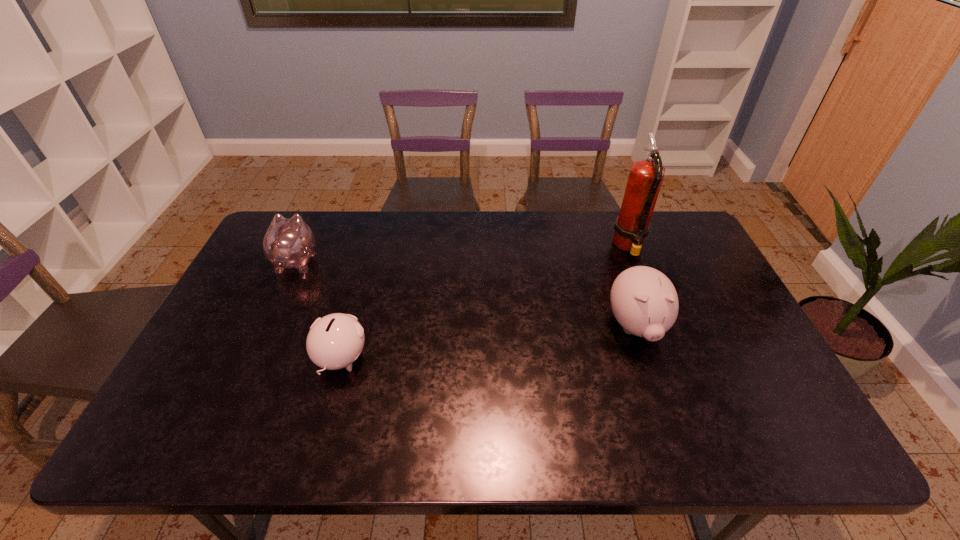
Identify the location of vacant point located on the front facing side of the leftmost piggy bank. The height and width of the screenshot is (540, 960). (311, 230).

Identify the location of blank space located 0.120m on the front facing side of the leftmost piggy bank. Image resolution: width=960 pixels, height=540 pixels. (314, 222).

The image size is (960, 540). Identify the location of vacant point located 0.110m on the front facing side of the leftmost piggy bank. (313, 224).

The image size is (960, 540). I want to click on free point located 0.050m on the right of the shortest piggy bank, so click(x=388, y=360).

Identify the location of fire extinguisher present at the far edge. (632, 225).

At what (x,y) coordinates should I click in order to perform the action: click on piggy bank that is at the far edge. Please return your answer as a coordinate pair (x, y). Image resolution: width=960 pixels, height=540 pixels. Looking at the image, I should click on (288, 243).

The width and height of the screenshot is (960, 540). Identify the location of object present at the left edge. (288, 243).

Identify the location of object that is at the far left corner. (288, 243).

The width and height of the screenshot is (960, 540). Identify the location of blank area at the far edge. (375, 240).

Where is `vacant region at the near edge of the desktop`? The height and width of the screenshot is (540, 960). vacant region at the near edge of the desktop is located at coordinates (611, 437).